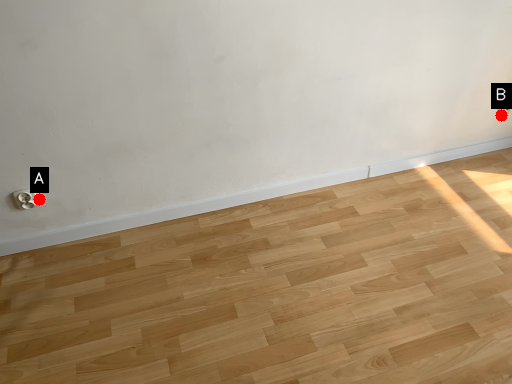
Question: Two points are circled on the image, labeled by A and B beside each circle. Which point appears farthest from the camera in this image?

Choices:
 (A) A is further
 (B) B is further

Answer: (B)